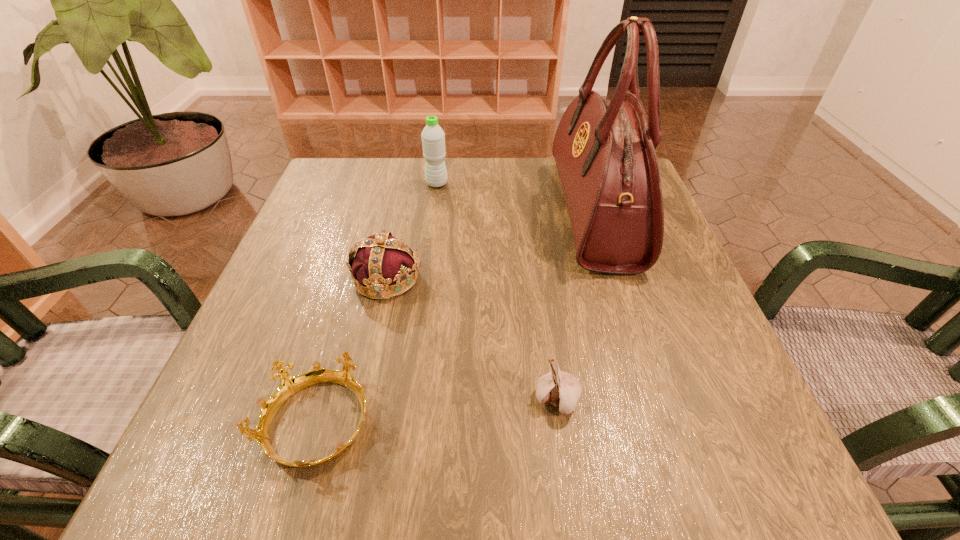
Locate an element on the screen. The image size is (960, 540). object at the near left corner is located at coordinates (289, 385).

Find the location of a particular element. This screenshot has height=540, width=960. object located in the far right corner section of the desktop is located at coordinates (604, 150).

Image resolution: width=960 pixels, height=540 pixels. In the image, there is a desktop. Find the location of `free space at the far edge`. free space at the far edge is located at coordinates click(488, 201).

Locate an element on the screen. The image size is (960, 540). free space at the near edge is located at coordinates (467, 451).

Where is `free space at the left edge of the desktop`? Image resolution: width=960 pixels, height=540 pixels. free space at the left edge of the desktop is located at coordinates (300, 269).

You are a GUI agent. You are given a task and a screenshot of the screen. Output one action in this format:
    pyautogui.click(x=<x>, y=<y>)
    Task: Click on the blank space at the far left corner of the desktop
    This screenshot has height=540, width=960.
    Given the screenshot: What is the action you would take?
    tap(340, 192)

This screenshot has height=540, width=960. I want to click on free space at the near left corner, so [x=237, y=451].

Where is `vacant space that is in between the tallest object and the water bottle`? vacant space that is in between the tallest object and the water bottle is located at coordinates (516, 198).

You are a GUI agent. You are given a task and a screenshot of the screen. Output one action in this format:
    pyautogui.click(x=<x>, y=<y>)
    Task: Click on the free space that is in between the farther crown and the second tallest object
    
    Given the screenshot: What is the action you would take?
    pyautogui.click(x=412, y=231)

Locate an element on the screen. The image size is (960, 540). free space between the fourth shortest object and the handbag is located at coordinates (516, 198).